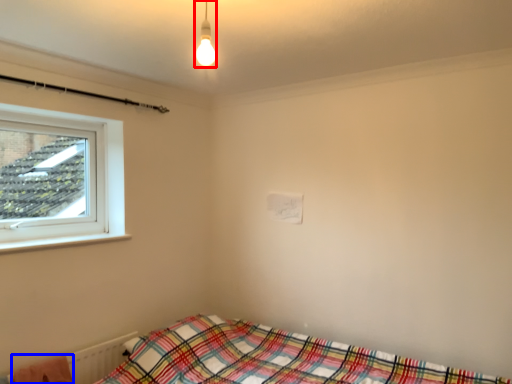
Question: Which of the following is the closest to the observer, light fixture (highlighted by a red box) or blanket (highlighted by a blue box)?

Choices:
 (A) light fixture
 (B) blanket

Answer: (A)